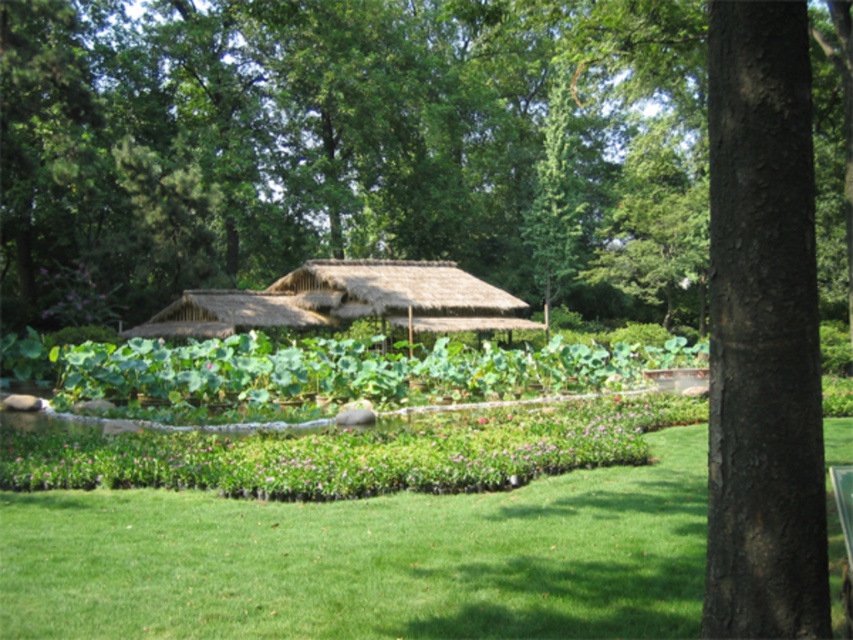
You are a gardener planning to install a new sprinkler system. You need to place a sprinkler between the dark brown textured tree trunk at center right and the thatched straw hut at center. Based on their positions, which object should the sprinkler be closer to?

The dark brown textured tree trunk at center right is positioned on the right side of the thatched straw hut at center, so the sprinkler should be placed closer to the thatched straw hut at center since it is located to the left of the tree trunk.

You are standing in the garden and want to take a photo of the green grass at lower center and the dark brown textured tree trunk at center right. Which object will occupy more space in your camera frame?

The green grass at lower center will occupy more space in your camera frame because it is bigger than the dark brown textured tree trunk at center right.